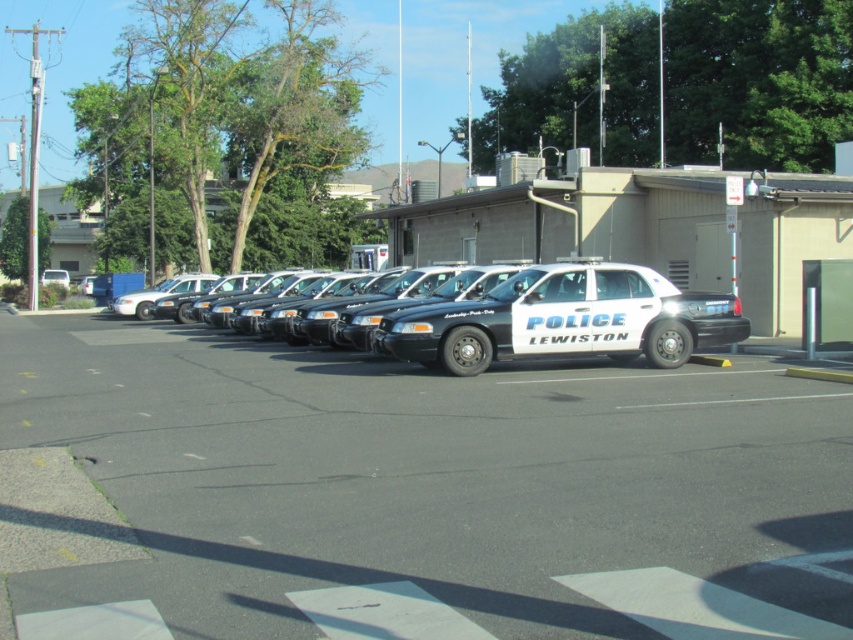
Question: Which of the following is the closest to the observer?

Choices:
 (A) white glossy police car at center
 (B) black glossy police car at center

Answer: (A)

Question: Observing the image, what is the correct spatial positioning of white glossy police car at center in reference to black glossy police car at center?

Choices:
 (A) below
 (B) above

Answer: (A)

Question: From the image, what is the correct spatial relationship of white glossy police car at center in relation to black glossy police car at center?

Choices:
 (A) left
 (B) right

Answer: (A)

Question: Which object appears closest to the camera in this image?

Choices:
 (A) white glossy police car at center
 (B) black glossy police car at center

Answer: (A)

Question: Is white glossy police car at center bigger than black glossy police car at center?

Choices:
 (A) no
 (B) yes

Answer: (B)